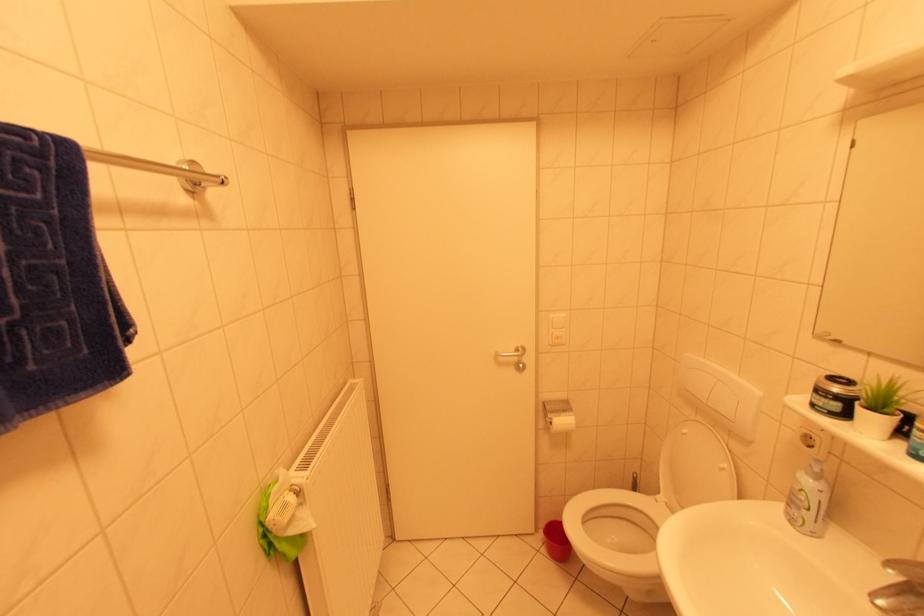
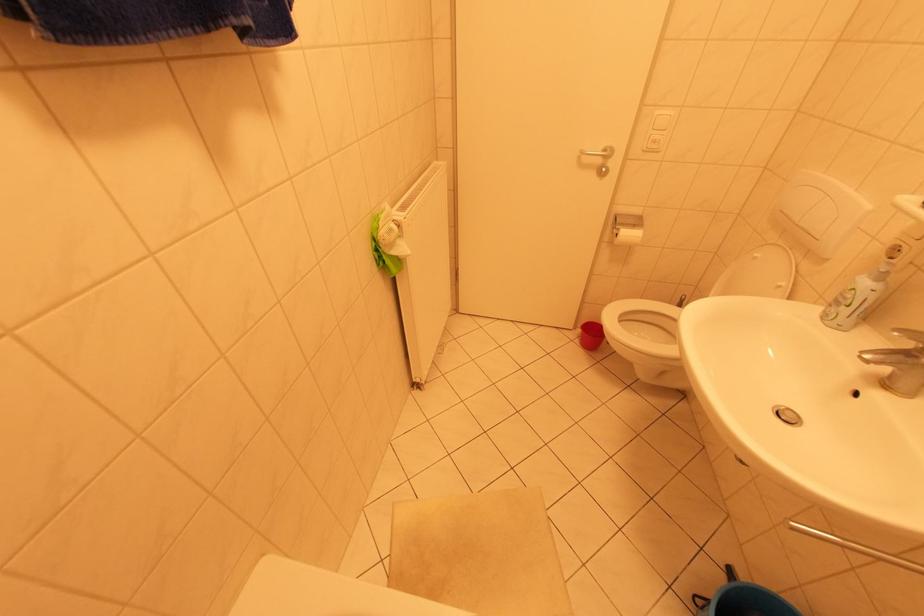
Question: Based on the continuous images, in which direction is the camera rotating? Reply with the corresponding letter.

Choices:
 (A) Left
 (B) Right
 (C) Up
 (D) Down

Answer: (D)